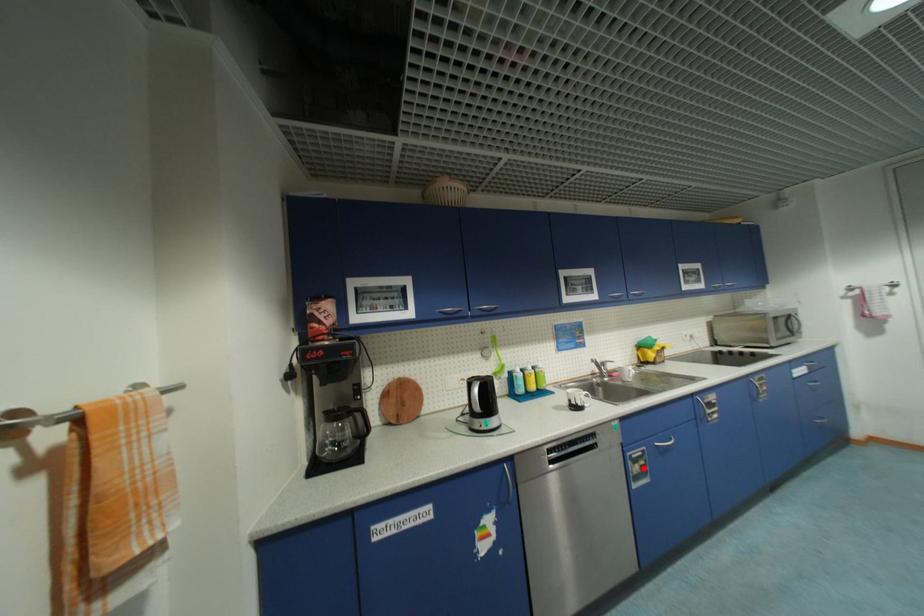
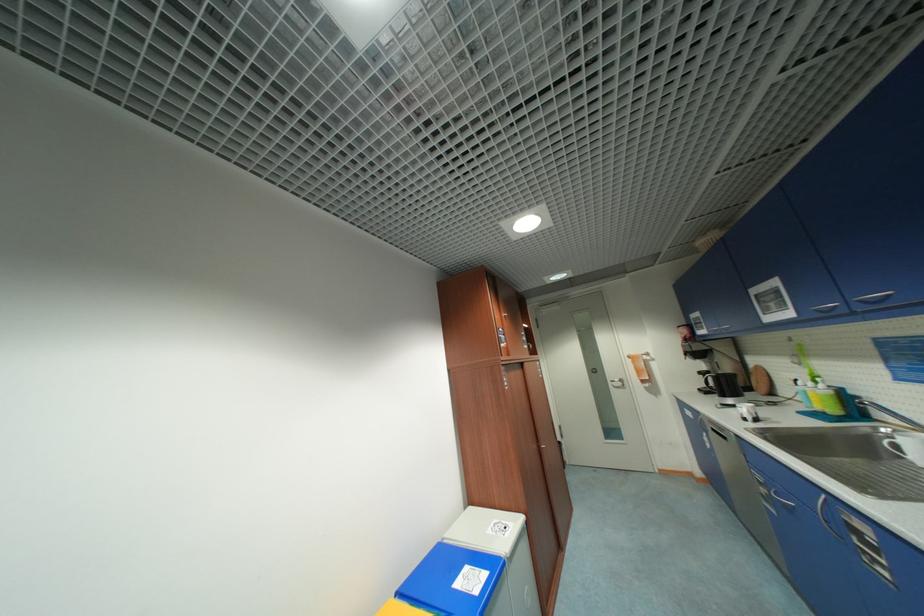
Question: I am providing you with two images of the same scene from different viewpoints. Given a red point in image1, look at the same physical point in image2. Is it:

Choices:
 (A) Closer to the viewpoint
 (B) Farther from the viewpoint

Answer: (A)